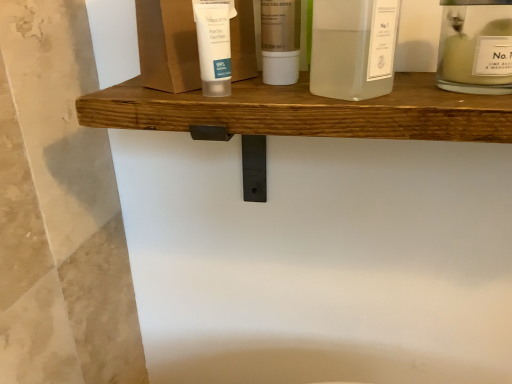
Question: Considering the relative sizes of translucent plastic tube at upper center, the 2th product positioned from the right, and translucent glass bottle at center, which is the second product from left to right, in the image provided, is translucent plastic tube at upper center, the 2th product positioned from the right, bigger than translucent glass bottle at center, which is the second product from left to right,?

Choices:
 (A) no
 (B) yes

Answer: (B)

Question: Does translucent plastic tube at upper center, the 2th product positioned from the right, have a smaller size compared to translucent glass bottle at center, which is the second product from left to right?

Choices:
 (A) no
 (B) yes

Answer: (A)

Question: Considering the relative positions of translucent plastic tube at upper center, the 2th product positioned from the right, and translucent glass bottle at center, which is the second product from left to right, in the image provided, is translucent plastic tube at upper center, the 2th product positioned from the right, to the left of translucent glass bottle at center, which is the second product from left to right, from the viewer's perspective?

Choices:
 (A) yes
 (B) no

Answer: (A)

Question: Is translucent plastic tube at upper center, the 2th product positioned from the right, located outside translucent glass bottle at center, which is the 1th product in right-to-left order?

Choices:
 (A) no
 (B) yes

Answer: (B)

Question: From the image's perspective, does translucent plastic tube at upper center, the 2th product positioned from the right, appear higher than translucent glass bottle at center, which is the 1th product in right-to-left order?

Choices:
 (A) no
 (B) yes

Answer: (B)

Question: Is translucent plastic bottle at center, arranged as the 2th toiletry when viewed from the right, taller or shorter than translucent plastic tube at upper center, acting as the 1th product starting from the left?

Choices:
 (A) short
 (B) tall

Answer: (A)

Question: Choose the correct answer: Is translucent plastic bottle at center, positioned as the 2th toiletry in left-to-right order, inside translucent plastic tube at upper center, acting as the 1th product starting from the left, or outside it?

Choices:
 (A) inside
 (B) outside

Answer: (B)

Question: From a real-world perspective, relative to translucent plastic tube at upper center, acting as the 1th product starting from the left, is translucent plastic bottle at center, arranged as the 2th toiletry when viewed from the right, vertically above or below?

Choices:
 (A) above
 (B) below

Answer: (B)

Question: In the image, is translucent plastic bottle at center, positioned as the 2th toiletry in left-to-right order, on the left side or the right side of translucent plastic tube at upper center, the 2th product positioned from the right?

Choices:
 (A) left
 (B) right

Answer: (B)

Question: Is translucent plastic bottle at center, arranged as the 2th toiletry when viewed from the right, inside the boundaries of translucent glass bottle at center, which is the second product from left to right, or outside?

Choices:
 (A) inside
 (B) outside

Answer: (B)

Question: From a real-world perspective, is translucent plastic bottle at center, positioned as the 2th toiletry in left-to-right order, positioned above or below translucent glass bottle at center, which is the 1th product in right-to-left order?

Choices:
 (A) below
 (B) above

Answer: (B)

Question: Is translucent plastic bottle at center, arranged as the 2th toiletry when viewed from the right, bigger or smaller than translucent glass bottle at center, which is the 1th product in right-to-left order?

Choices:
 (A) big
 (B) small

Answer: (B)

Question: In the image, is translucent plastic bottle at center, arranged as the 2th toiletry when viewed from the right, positioned in front of or behind translucent glass bottle at center, which is the second product from left to right?

Choices:
 (A) front
 (B) behind

Answer: (B)

Question: From a real-world perspective, is white matte tube at center, the first toiletry positioned from the left, physically located above or below translucent plastic bottle at center, positioned as the 2th toiletry in left-to-right order?

Choices:
 (A) below
 (B) above

Answer: (A)

Question: Do you think white matte tube at center, the first toiletry positioned from the left, is within translucent plastic bottle at center, arranged as the 2th toiletry when viewed from the right, or outside of it?

Choices:
 (A) inside
 (B) outside

Answer: (B)